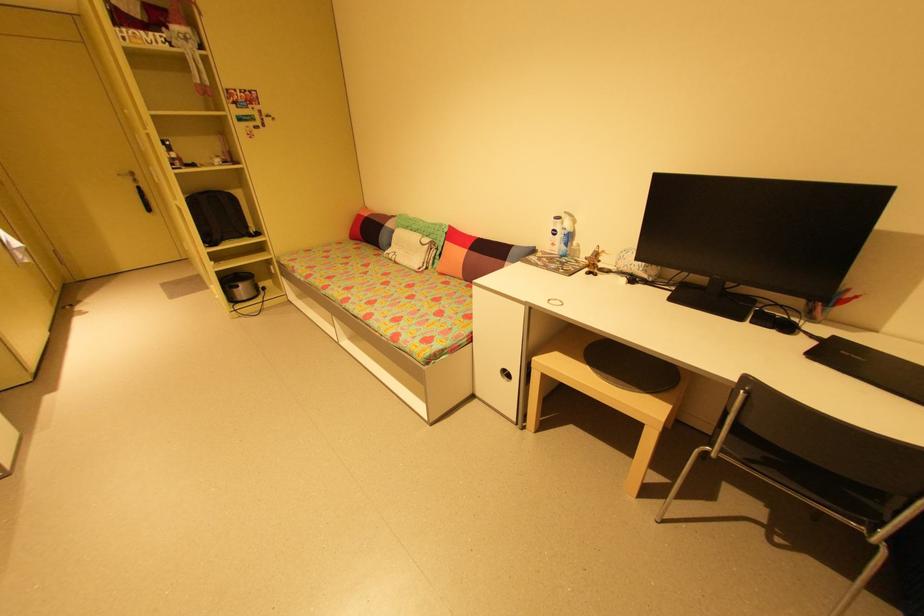
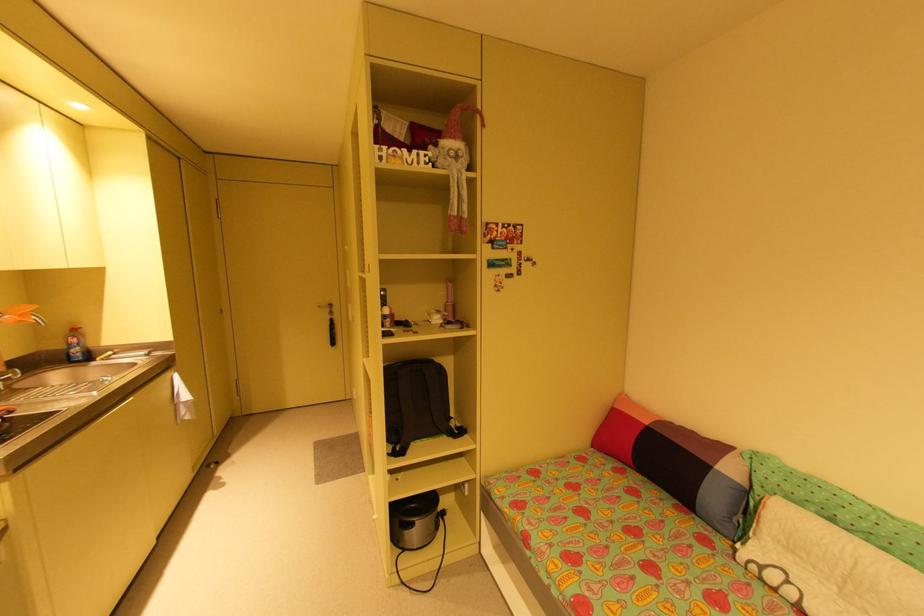
In the second image, find the point that corresponds to (x=262, y=235) in the first image.

(466, 431)